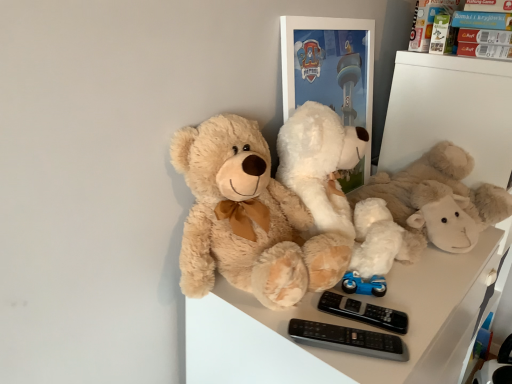
Question: Is white plush toy at center, which appears as the second teddy bear when viewed from the left, spatially inside fluffy beige teddy bear at center, the first teddy bear in the left-to-right sequence, or outside of it?

Choices:
 (A) inside
 (B) outside

Answer: (B)

Question: Is white plush toy at center, which appears as the second teddy bear when viewed from the left, in front of or behind fluffy beige teddy bear at center, the first teddy bear in the left-to-right sequence, in the image?

Choices:
 (A) behind
 (B) front

Answer: (A)

Question: Estimate the real-world distances between objects in this image. Which object is farther from the black plastic remote controls at lower center?

Choices:
 (A) fluffy beige teddy bear at center, the first teddy bear in the left-to-right sequence
 (B) black plastic remote at lower right
 (C) matte cardboard box at upper right
 (D) white plush toy at center, which appears as the first teddy bear when viewed from the right

Answer: (C)

Question: Which is farther from the white plush toy at center, which appears as the second teddy bear when viewed from the left?

Choices:
 (A) black plastic remote at lower right
 (B) matte cardboard box at upper right
 (C) black plastic remote controls at lower center
 (D) fluffy beige teddy bear at center, positioned as the second teddy bear in right-to-left order

Answer: (C)